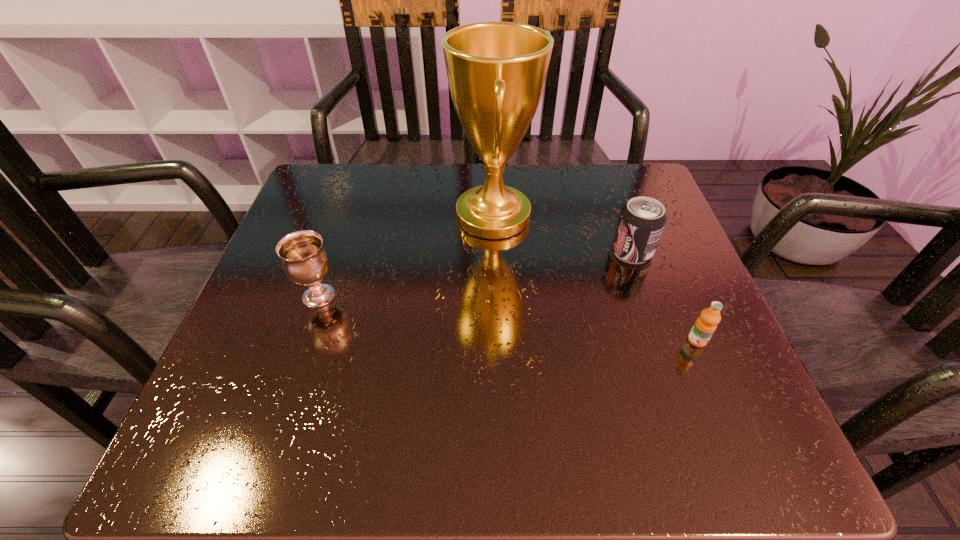
The image size is (960, 540). I want to click on free area in between the second object from left to right and the soda can, so click(x=563, y=234).

Locate an element on the screen. The height and width of the screenshot is (540, 960). free space between the chalice and the soda can is located at coordinates (475, 274).

Where is `free space that is in between the shortest object and the award`? The height and width of the screenshot is (540, 960). free space that is in between the shortest object and the award is located at coordinates (595, 278).

Where is `free space between the orange juice and the second object from right to left`? Image resolution: width=960 pixels, height=540 pixels. free space between the orange juice and the second object from right to left is located at coordinates (664, 296).

The image size is (960, 540). Find the location of `object that stands as the closest to the chalice`. object that stands as the closest to the chalice is located at coordinates (496, 71).

Identify which object is the second nearest to the third farthest object. Please provide its 2D coordinates. Your answer should be formatted as a tuple, i.e. [(x, y)], where the tuple contains the x and y coordinates of a point satisfying the conditions above.

[(641, 221)]

Identify the location of blank space that satisfies the following two spatial constraints: 1. on the back side of the second object from right to left; 2. by the handles of the tallest object. This screenshot has height=540, width=960. point(619,216).

The width and height of the screenshot is (960, 540). Identify the location of free space that satisfies the following two spatial constraints: 1. on the back side of the second nearest object; 2. on the right side of the second object from right to left. (334, 252).

The image size is (960, 540). Identify the location of blank area in the image that satisfies the following two spatial constraints: 1. by the handles of the third object from right to left; 2. on the right side of the second object from right to left. (494, 252).